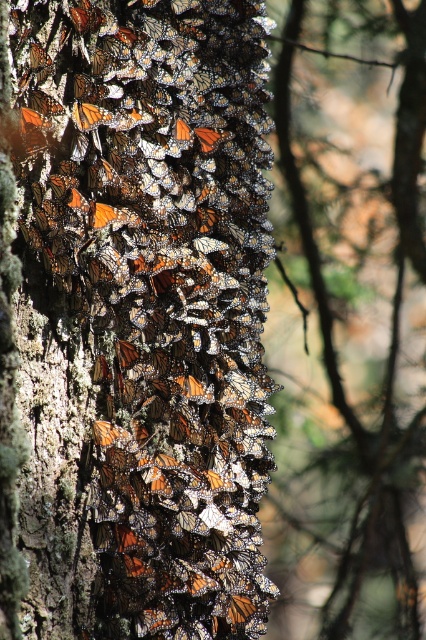
The width and height of the screenshot is (426, 640). Describe the element at coordinates (141, 314) in the screenshot. I see `orange and black wings at center` at that location.

Locate an element on the screen. The image size is (426, 640). orange and black wings at center is located at coordinates (141, 314).

The height and width of the screenshot is (640, 426). What are the coordinates of `orange and black wings at center` in the screenshot? It's located at (141, 314).